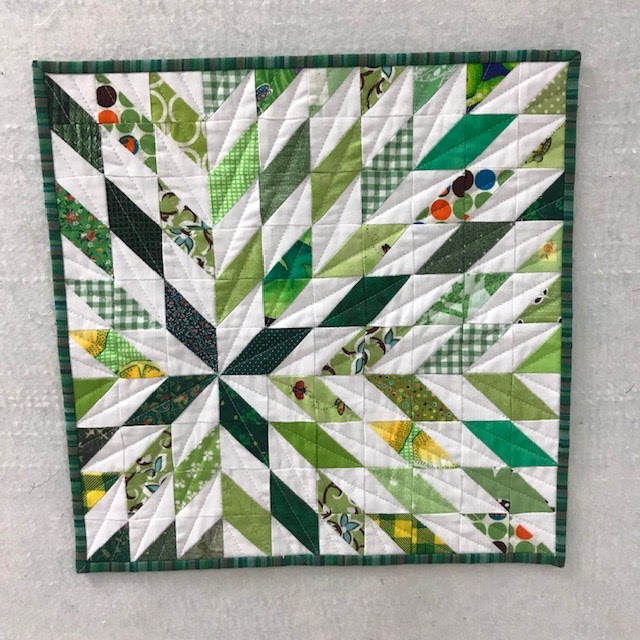
Find the location of a particular element. The width and height of the screenshot is (640, 640). upper left quilt corner is located at coordinates (34, 60).